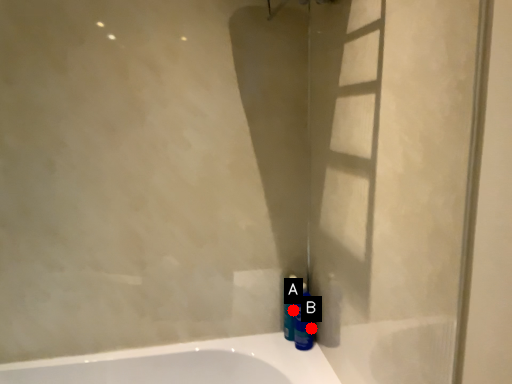
Question: Two points are circled on the image, labeled by A and B beside each circle. Which point appears closest to the camera in this image?

Choices:
 (A) A is closer
 (B) B is closer

Answer: (A)